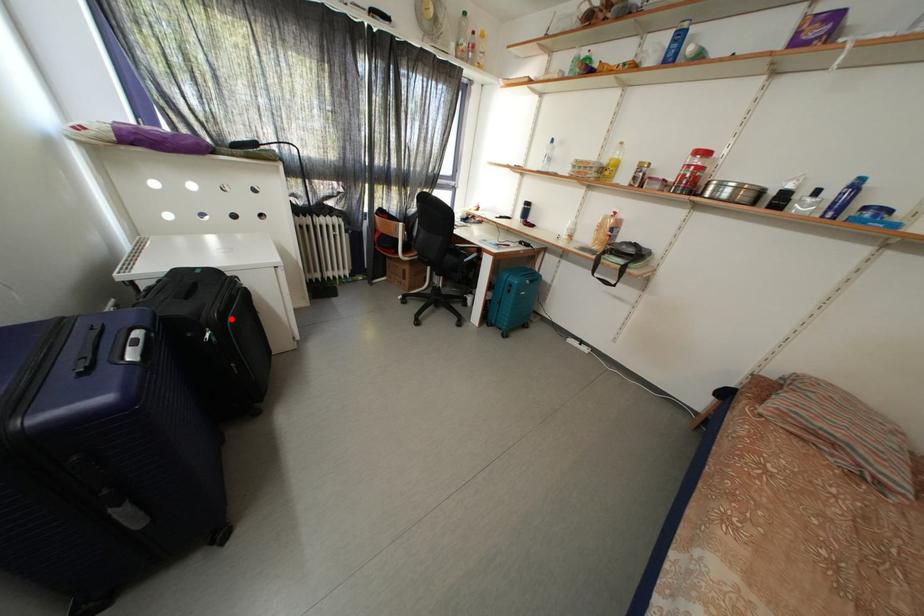
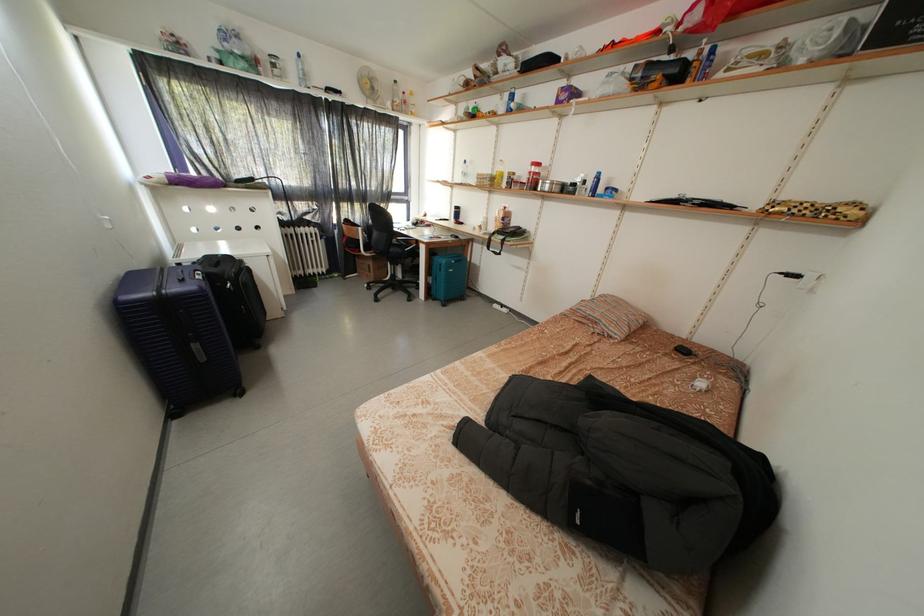
Question: I am providing you with two images of the same scene from different viewpoints. A red point is marked on the first image. Can you still see the location of the red point in image 2?

Choices:
 (A) Yes
 (B) No

Answer: (A)